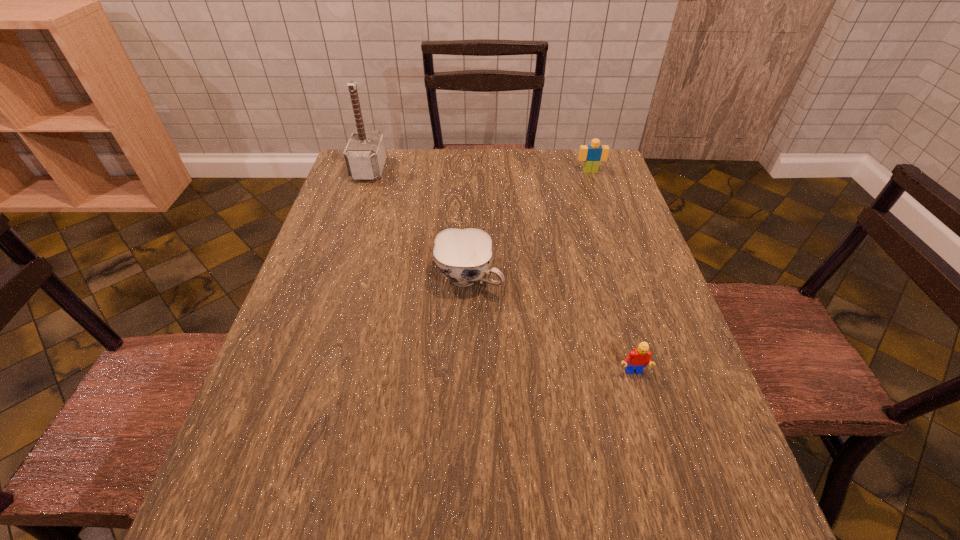
Where is `hammer`? This screenshot has width=960, height=540. hammer is located at coordinates (365, 154).

Locate an element on the screen. The image size is (960, 540). the tallest object is located at coordinates (365, 154).

Locate an element on the screen. the taller Lego is located at coordinates (592, 154).

Find the location of a particular element. chinaware is located at coordinates (463, 256).

Where is `the second nearest object`? the second nearest object is located at coordinates (463, 256).

This screenshot has height=540, width=960. What are the coordinates of `the nearer Lego` in the screenshot? It's located at (639, 358).

Where is `the nearest object`? The image size is (960, 540). the nearest object is located at coordinates (639, 358).

The height and width of the screenshot is (540, 960). In order to click on vacant point located for striking with the head of the tallest object in this screenshot , I will do `click(505, 170)`.

The height and width of the screenshot is (540, 960). I want to click on free space located 0.300m on the face of the taller Lego, so click(x=610, y=232).

You are a GUI agent. You are given a task and a screenshot of the screen. Output one action in this format:
    pyautogui.click(x=<x>, y=<y>)
    Task: Click on the vacant position located 0.140m on the left of the second object from left to right
    
    Given the screenshot: What is the action you would take?
    pyautogui.click(x=379, y=278)